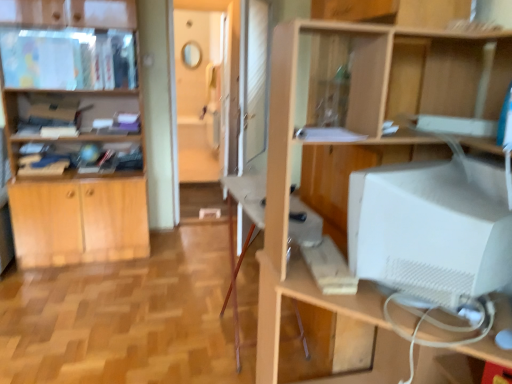
Where is `vacant space situated on the left part of wooden computer desk at center`? The width and height of the screenshot is (512, 384). vacant space situated on the left part of wooden computer desk at center is located at coordinates (158, 337).